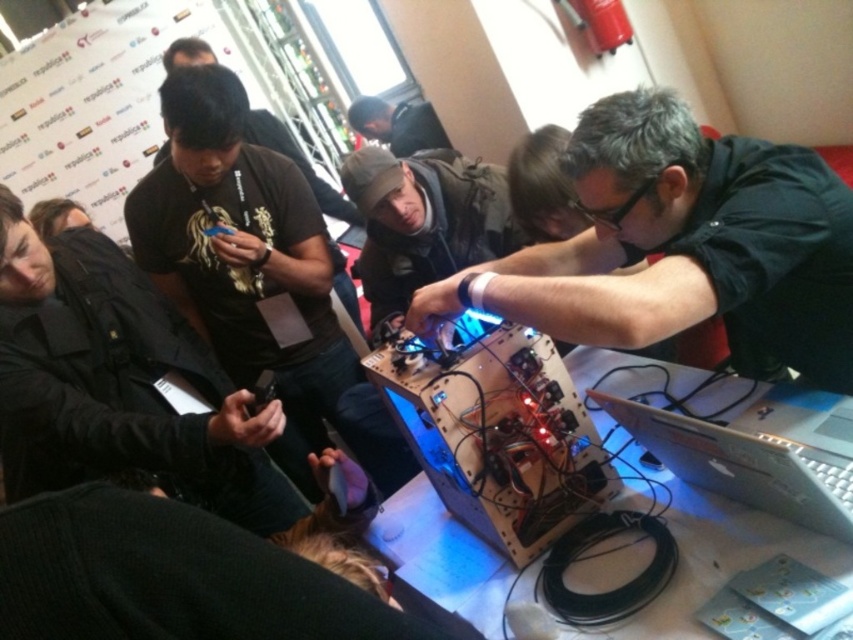
You are a photographer trying to capture a closeup shot of the matte black shirt at center and dark gray fabric jacket at center. The camera lens can only focus on objects that are not wider than 30 cm. Can you focus on both objects simultaneously?

The matte black shirt at center might be wider than dark gray fabric jacket at center. Since the camera lens can only focus on objects not wider than 30 cm, you need to check the width of the wider object. If the matte black shirt at center is wider than 30 cm, then focusing on both might not be possible. However, if it is within 30 cm, both can be captured.

You are a technician who needs to adjust the camera to get a clear view of the wooden circuit board at center. The camera is currently positioned at a distance. What is the minimum distance you should move the camera closer to the circuit board to ensure it can capture the entire board in focus?

The wooden circuit board at center and the camera are 1.18 meters apart. To ensure the camera captures the entire board in focus, move it closer to within the recommended focusing distance specified by the camera manufacturer, but not closer than 1.18 meters unless the board requires a closer inspection.